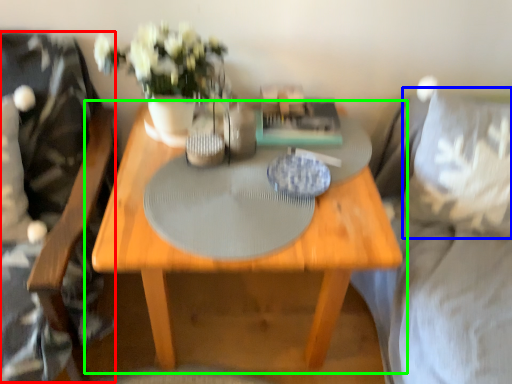
Question: Based on their relative distances, which object is farther from swivel chair (highlighted by a red box)? Choose from pillow (highlighted by a blue box) and table (highlighted by a green box).

Choices:
 (A) pillow
 (B) table

Answer: (A)